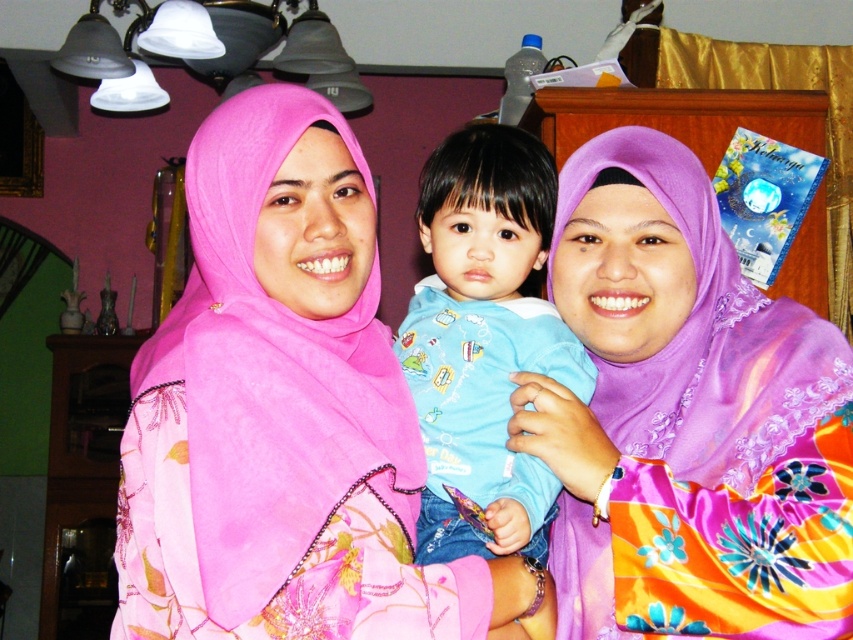
In the image, there are two adults wearing hijabs and a child. The pink satin hijab at center is represented by point (283, 412). Where is the pink satin hijab located in relation to the other objects?

The pink satin hijab at center is located at the coordinates (283, 412), which is the center of the image.

From the picture: You are a photographer adjusting your camera focus. You notice the purple satin hijab at center and the blue cotton shirt at center. Which object should you focus on first if you want to capture both in sharp detail?

The purple satin hijab at center is closer to the viewer than the blue cotton shirt at center, so you should focus on the purple satin hijab at center first to ensure both are in focus.